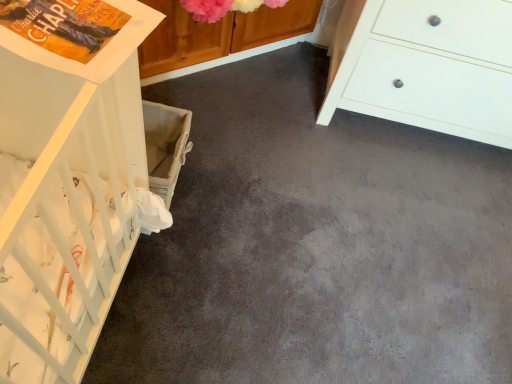
Describe the element at coordinates (426, 66) in the screenshot. I see `white matte chest of drawers at upper right` at that location.

Locate an element on the screen. white matte chest of drawers at upper right is located at coordinates (426, 66).

Image resolution: width=512 pixels, height=384 pixels. In order to click on white matte chest of drawers at upper right in this screenshot , I will do `click(426, 66)`.